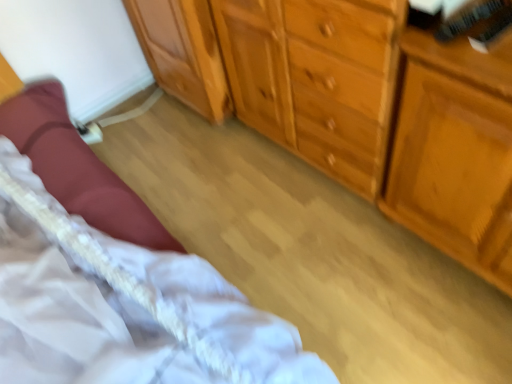
Question: From the image's perspective, relative to white lace bed at lower left, is wooden cabinet at center, the 1th cabinetry in the left-to-right sequence, above or below?

Choices:
 (A) below
 (B) above

Answer: (B)

Question: Is point (151, 41) positioned closer to the camera than point (262, 379)?

Choices:
 (A) closer
 (B) farther

Answer: (B)

Question: Based on their relative distances, which object is nearer to the white lace bed at lower left?

Choices:
 (A) wooden chest of drawers at center
 (B) light brown wood dresser at center, which is the second cabinetry from left to right
 (C) wooden dresser at right
 (D) wooden cabinet at center, the 1th cabinetry in the left-to-right sequence

Answer: (A)

Question: Based on their relative distances, which object is farther from the light brown wood dresser at center, placed as the first cabinetry when sorted from right to left?

Choices:
 (A) wooden chest of drawers at center
 (B) wooden cabinet at center, the 1th cabinetry in the left-to-right sequence
 (C) white lace bed at lower left
 (D) wooden dresser at right

Answer: (C)